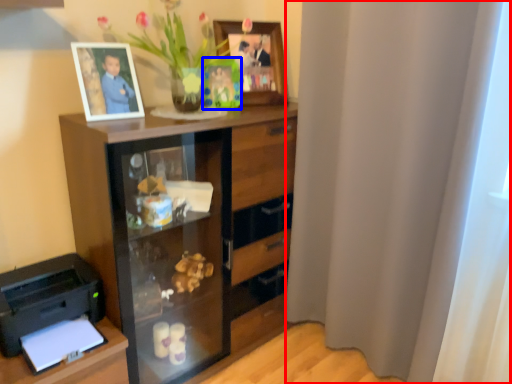
Question: Which of the following is the closest to the observer, curtain (highlighted by a red box) or picture frame (highlighted by a blue box)?

Choices:
 (A) curtain
 (B) picture frame

Answer: (A)